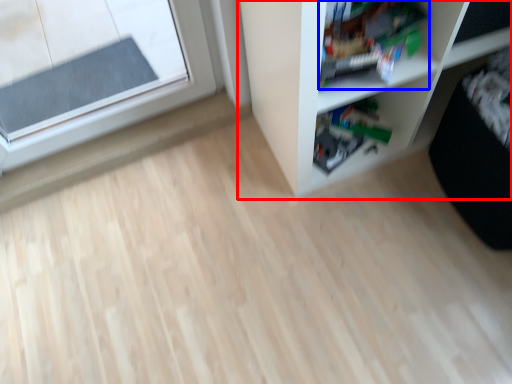
Question: Which of the following is the farthest to the observer, shelf (highlighted by a red box) or toy (highlighted by a blue box)?

Choices:
 (A) shelf
 (B) toy

Answer: (B)